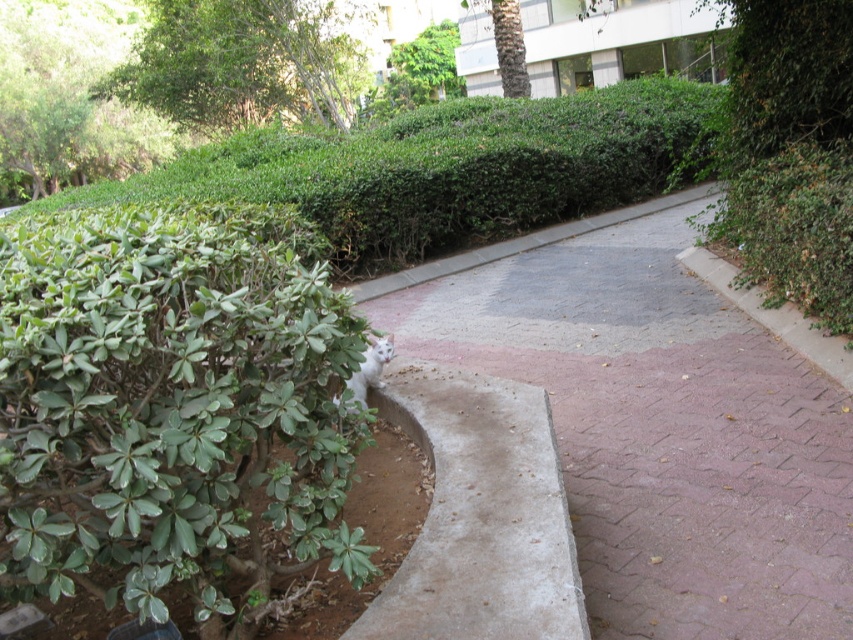
Question: Can you confirm if green leafy bush at lower left is thinner than gray concrete curb at lower left?

Choices:
 (A) no
 (B) yes

Answer: (A)

Question: Which point appears farthest from the camera in this image?

Choices:
 (A) (172, 86)
 (B) (398, 136)
 (C) (556, 621)
 (D) (514, 51)

Answer: (A)

Question: Among these points, which one is farthest from the camera?

Choices:
 (A) (53, 378)
 (B) (250, 96)
 (C) (496, 618)
 (D) (625, 285)

Answer: (B)

Question: Which object appears closest to the camera in this image?

Choices:
 (A) pink brick pavement at center
 (B) brown textured palm tree at upper center
 (C) green leafy bush at lower left
 (D) green leafy tree at upper left

Answer: (C)

Question: Is green leafy bush at lower left bigger than green leafy hedge at upper left?

Choices:
 (A) yes
 (B) no

Answer: (B)

Question: Can you confirm if green leafy bush at lower left is wider than gray concrete curb at lower left?

Choices:
 (A) no
 (B) yes

Answer: (B)